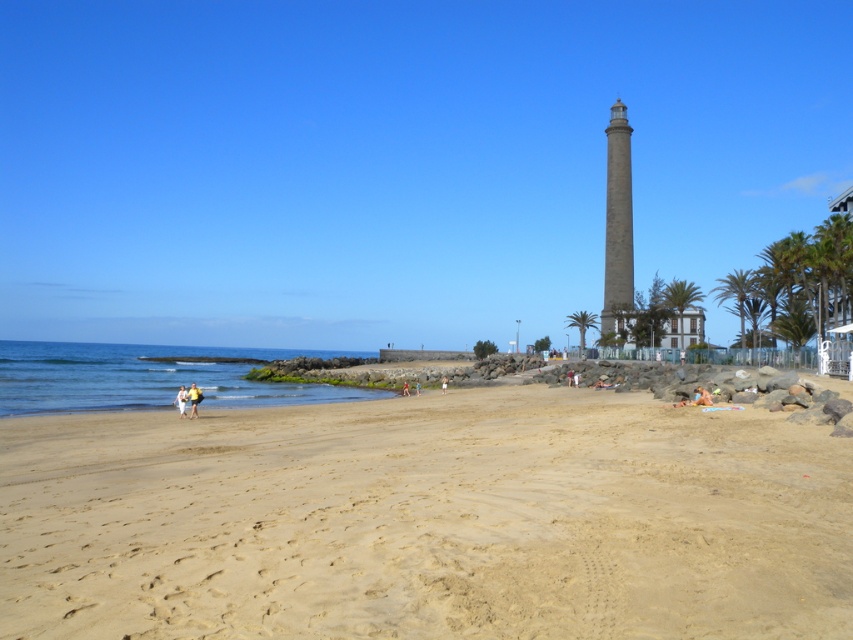
Question: Which object is positioned farthest from the white fabric at lower left?

Choices:
 (A) light brown sand at lower center
 (B) green leafy palm tree at center
 (C) beige sand at lower right
 (D) green leafy palm tree at center-right

Answer: (B)

Question: Which of these objects is positioned farthest from the green leafy palm tree at center?

Choices:
 (A) green leafy palm tree at right
 (B) yellow fabric at lower left
 (C) green leafy palm tree at center-right

Answer: (B)

Question: Does gray stone tower at upper right have a lesser width compared to green leafy palm tree at right?

Choices:
 (A) yes
 (B) no

Answer: (A)

Question: Is green leafy palm tree at center further to the viewer compared to beige sand at lower right?

Choices:
 (A) no
 (B) yes

Answer: (B)

Question: Which point is farther to the camera?

Choices:
 (A) (567, 316)
 (B) (189, 388)
 (C) (184, 394)

Answer: (A)

Question: Considering the relative positions of gray stone tower at upper right and white fabric at lower left in the image provided, where is gray stone tower at upper right located with respect to white fabric at lower left?

Choices:
 (A) above
 (B) below

Answer: (A)